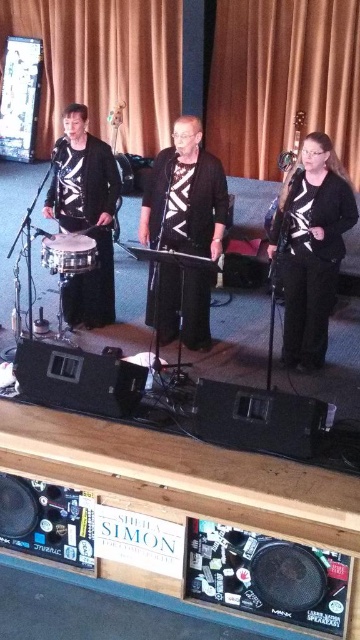
You are a stagehand setting up microphones for the performers. The black matte guitar at right and the matte silver drum at left are both on the stage. Which object is closer to the front edge of the stage?

The black matte guitar at right is closer to the front edge of the stage because it is in front of the matte silver drum at left.

You are a stagehand setting up equipment. You need to move the matte black drum at left and the matte silver drum at left. Which drum should you move first if you want to access the one underneath?

The matte silver drum at left is underneath the matte black drum at left, so you should move the matte black drum at left first to access the matte silver drum at left.